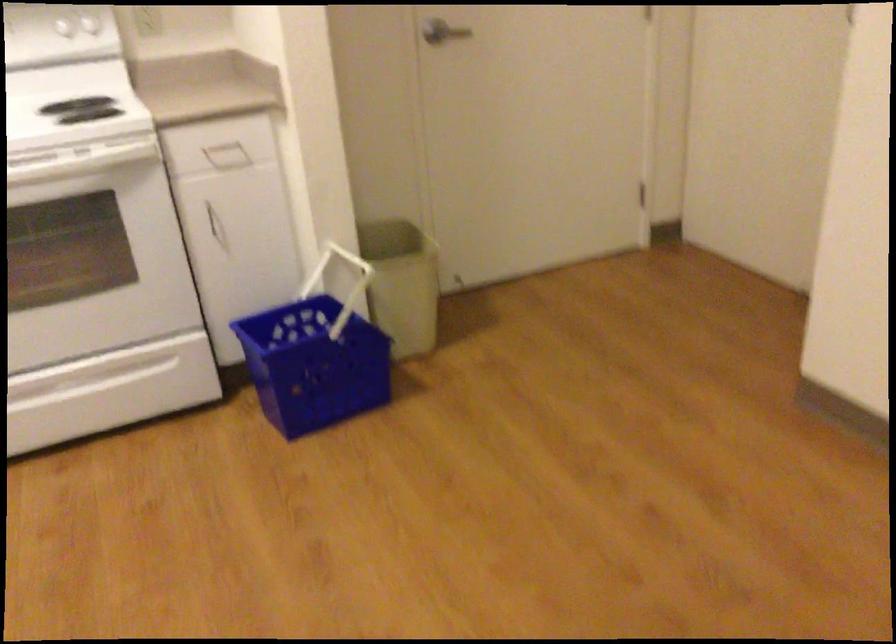
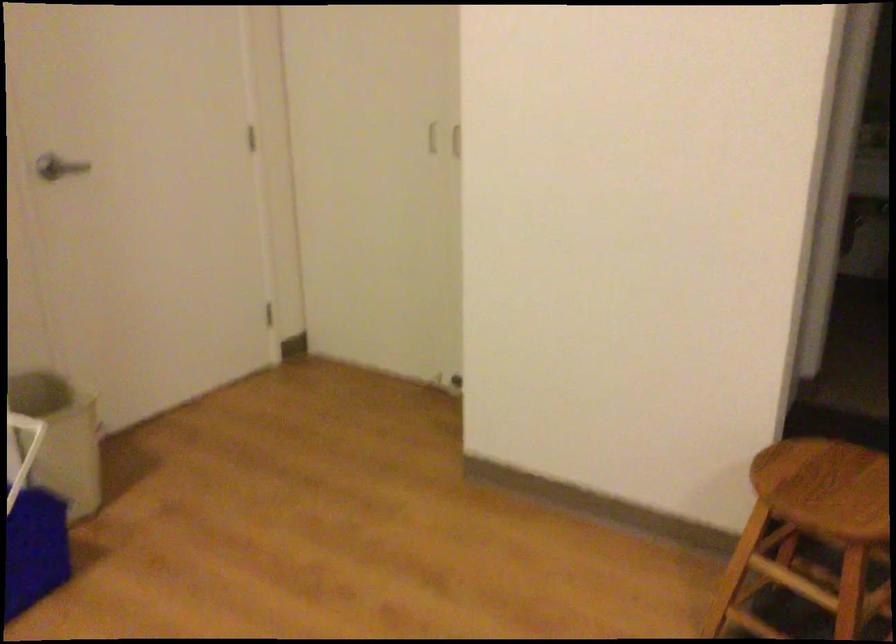
Question: The images are taken continuously from a first-person perspective. In which direction is your viewpoint rotating?

Choices:
 (A) Left
 (B) Right
 (C) Up
 (D) Down

Answer: (B)